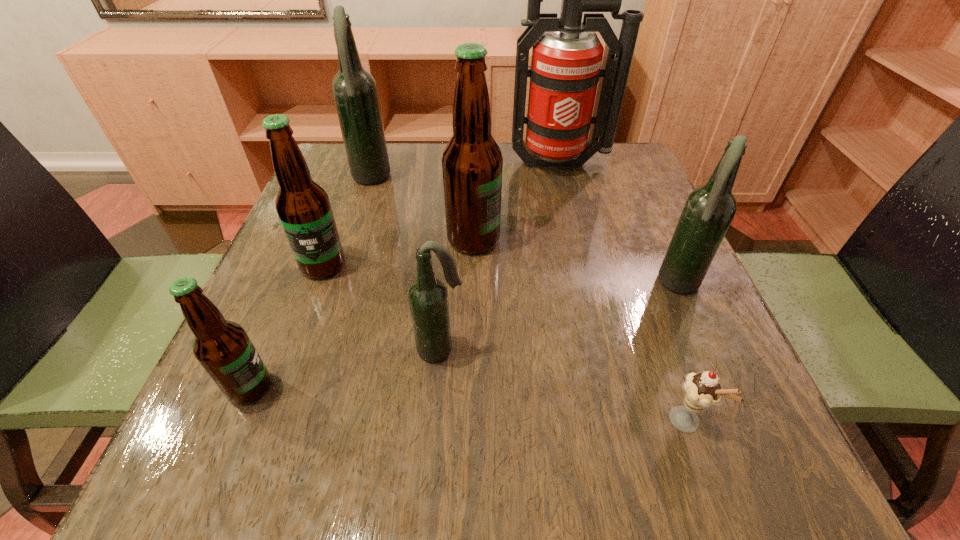
At what (x,y) coordinates should I click in order to perform the action: click on the smallest brown beer bottle. Please return your answer as a coordinate pair (x, y). This screenshot has height=540, width=960. Looking at the image, I should click on click(223, 348).

This screenshot has width=960, height=540. What are the coordinates of `the shortest object` in the screenshot? It's located at (702, 390).

This screenshot has width=960, height=540. What are the coordinates of `free space located on the front label side of the red fire extinguisher` in the screenshot? It's located at (576, 226).

You are a GUI agent. You are given a task and a screenshot of the screen. Output one action in this format:
    pyautogui.click(x=<x>, y=<y>)
    Task: Click on the free space located on the right of the farthest beer bottle
    Image resolution: width=960 pixels, height=540 pixels.
    Given the screenshot: What is the action you would take?
    pyautogui.click(x=447, y=180)

Locate an element on the screen. vacant space situated 0.110m on the label of the rightmost brown beer bottle is located at coordinates (553, 240).

Identify the location of vacant area situated on the front of the rightmost beer bottle. (769, 484).

Locate an element on the screen. The height and width of the screenshot is (540, 960). vacant space located 0.180m on the label of the second smallest brown beer bottle is located at coordinates (288, 362).

The width and height of the screenshot is (960, 540). Find the location of `vacant space situated 0.190m on the right of the smallest dark beer bottle`. vacant space situated 0.190m on the right of the smallest dark beer bottle is located at coordinates (x=581, y=349).

At what (x,y) coordinates should I click in order to perform the action: click on vacant region located 0.280m on the label of the smallest brown beer bottle. Please return your answer as a coordinate pair (x, y). Looking at the image, I should click on (456, 387).

What are the coordinates of `blank space located 0.120m on the left of the shortest object` in the screenshot? It's located at (582, 422).